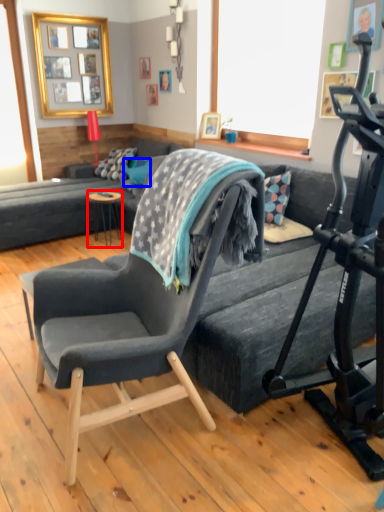
Question: Which object appears farthest to the camera in this image, table (highlighted by a red box) or pillow (highlighted by a blue box)?

Choices:
 (A) table
 (B) pillow

Answer: (B)